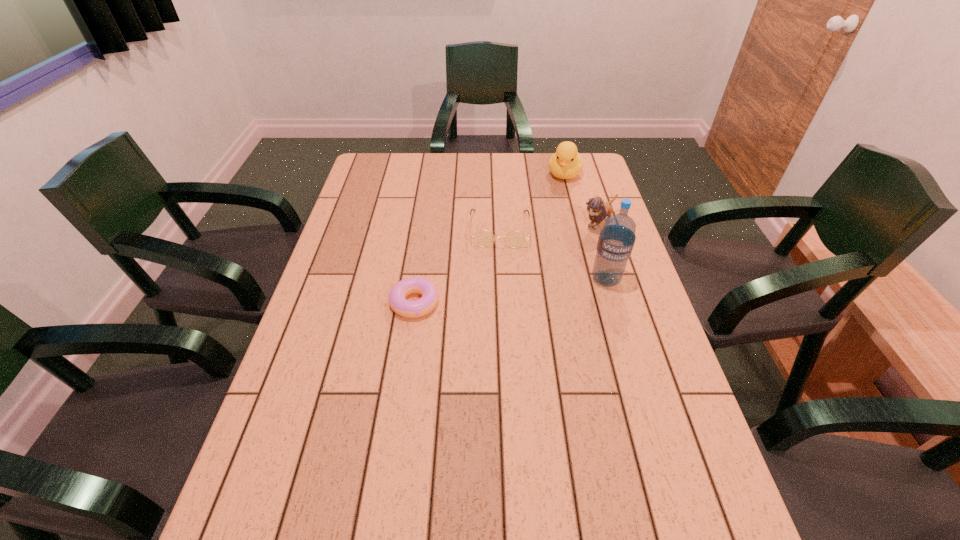
Identify the location of vacant space on the desktop that is between the shortest object and the tallest object and is positioned on the front-facing side of the duck. This screenshot has height=540, width=960. (539, 288).

Locate an element on the screen. free space on the desktop that is between the shortest object and the tallest object and is positioned on the lenses of the fourth object from right to left is located at coordinates (499, 292).

The width and height of the screenshot is (960, 540). In order to click on free space on the desktop that is between the shortest object and the tallest object and is positioned on the front-facing side of the kitten in this screenshot , I will do `click(512, 291)`.